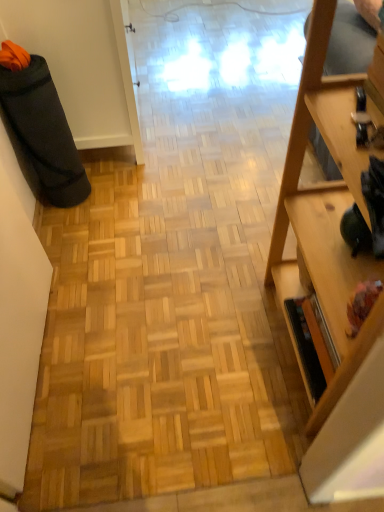
Where is `vacant space in front of black fabric bag at left`? Image resolution: width=384 pixels, height=512 pixels. vacant space in front of black fabric bag at left is located at coordinates (75, 217).